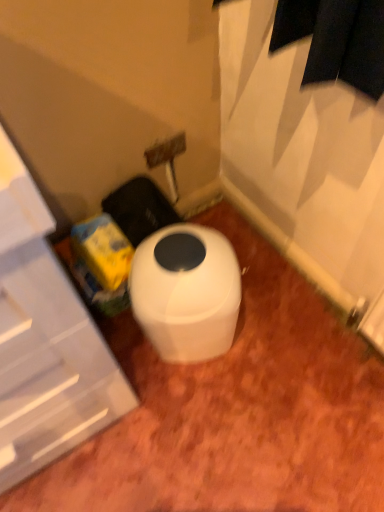
I want to click on free space in front of white glossy toilet at center, so click(x=205, y=413).